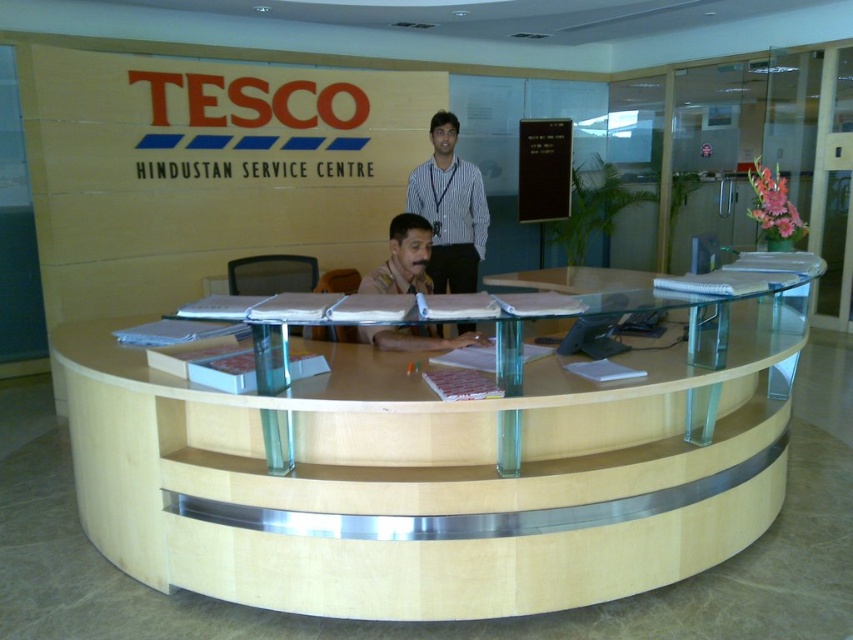
Between light wood/woodenobject at center and brown uniform at center, which one appears on the right side from the viewer's perspective?

From the viewer's perspective, light wood/woodenobject at center appears more on the right side.

Is light wood/woodenobject at center to the right of brown uniform at center from the viewer's perspective?

Yes, light wood/woodenobject at center is to the right of brown uniform at center.

The width and height of the screenshot is (853, 640). I want to click on light wood/woodenobject at center, so click(x=432, y=477).

Does white striped shirt at upper center lie in front of brown uniform at center?

No, it is not.

Does white striped shirt at upper center appear over brown uniform at center?

Indeed, white striped shirt at upper center is positioned over brown uniform at center.

This screenshot has height=640, width=853. I want to click on white striped shirt at upper center, so click(450, 209).

This screenshot has width=853, height=640. I want to click on white striped shirt at upper center, so click(x=450, y=209).

Can you confirm if light wood/woodenobject at center is wider than white striped shirt at upper center?

Yes, light wood/woodenobject at center is wider than white striped shirt at upper center.

Is point (641, 557) farther from viewer compared to point (433, 202)?

No, (641, 557) is in front of (433, 202).

Find the location of `light wood/woodenobject at center`. light wood/woodenobject at center is located at coordinates (432, 477).